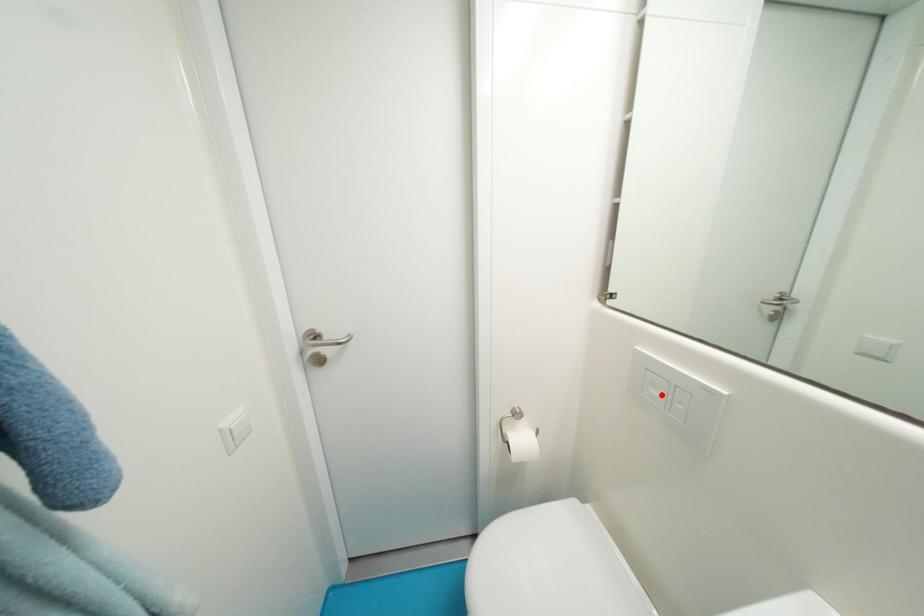
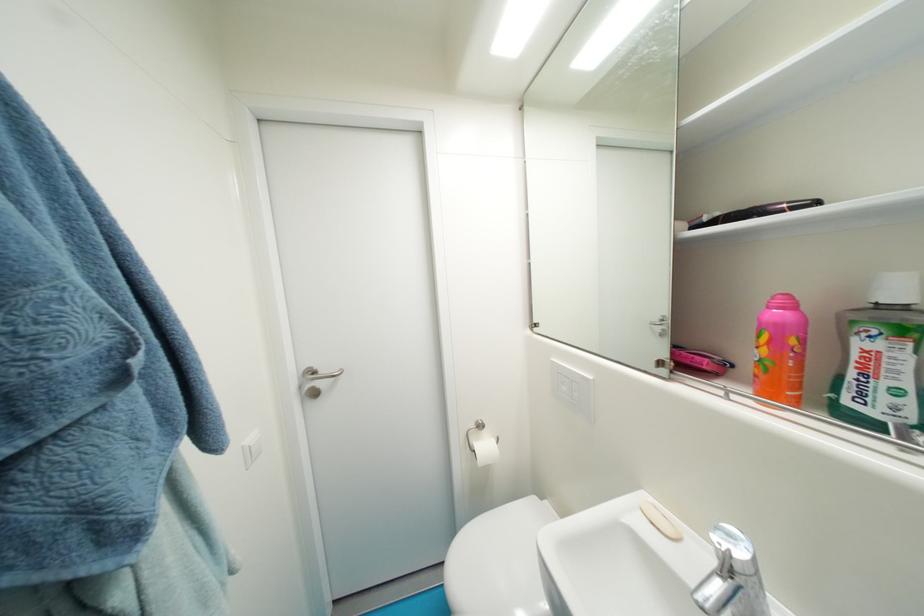
Where in the second image is the point corresponding to the highlighted location from the first image?

(570, 390)